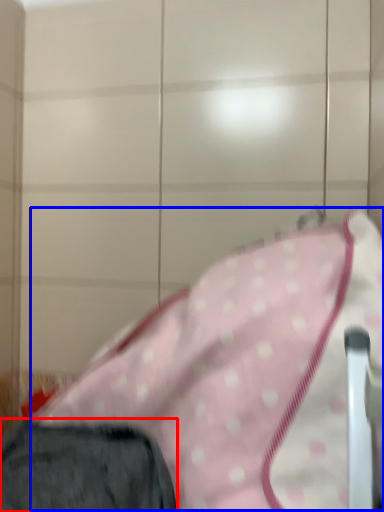
Question: Among these objects, which one is nearest to the camera, trousers (highlighted by a red box) or blanket (highlighted by a blue box)?

Choices:
 (A) trousers
 (B) blanket

Answer: (A)